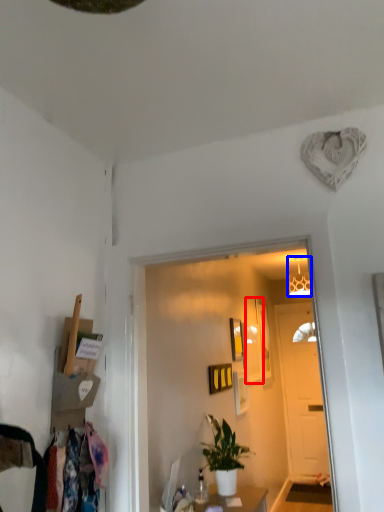
Question: Which object is closer to the camera taking this photo, picture frame (highlighted by a red box) or lamp (highlighted by a blue box)?

Choices:
 (A) picture frame
 (B) lamp

Answer: (A)